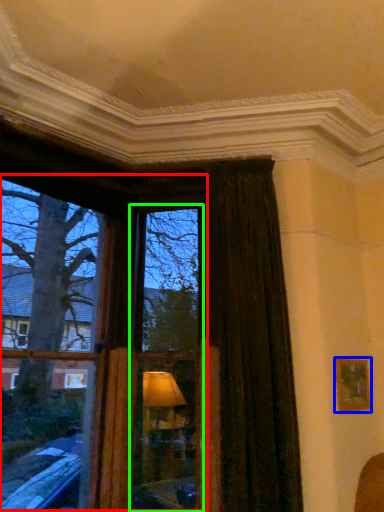
Question: Which object is the farthest from bay window (highlighted by a red box)? Choose among these: picture frame (highlighted by a blue box) or window frame (highlighted by a green box).

Choices:
 (A) picture frame
 (B) window frame

Answer: (A)